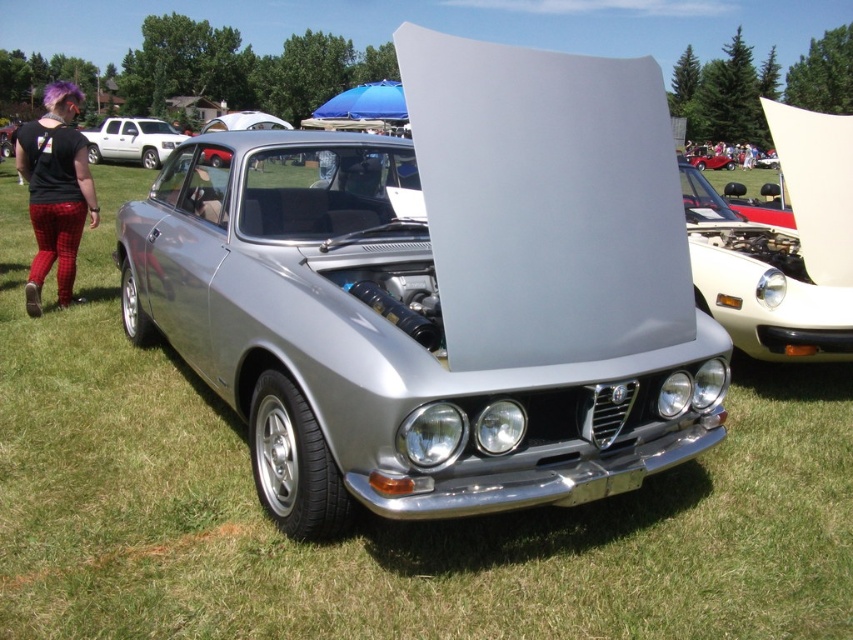
Does plaid fabric pants at left have a smaller size compared to satin silver car at center?

No, plaid fabric pants at left is not smaller than satin silver car at center.

Does point (41, 186) come in front of point (207, 156)?

That is False.

Does point (45, 221) lie in front of point (236, 116)?

That is True.

The height and width of the screenshot is (640, 853). In order to click on plaid fabric pants at left in this screenshot , I will do `click(55, 189)`.

Which of these two, plaid fabric pants at left or white matte truck at upper left, stands shorter?

white matte truck at upper left

Is point (62, 166) behind point (86, 138)?

No, (62, 166) is in front of (86, 138).

Identify the location of plaid fabric pants at left. [x=55, y=189].

From the picture: Can you confirm if white glossy car at center is positioned to the left of satin silver car at center?

In fact, white glossy car at center is to the right of satin silver car at center.

Which is behind, point (827, 156) or point (248, 125)?

Positioned behind is point (248, 125).

Who is more forward, [755,323] or [260,115]?

Point [755,323] is in front.

Locate an element on the screen. The width and height of the screenshot is (853, 640). white glossy car at center is located at coordinates (782, 248).